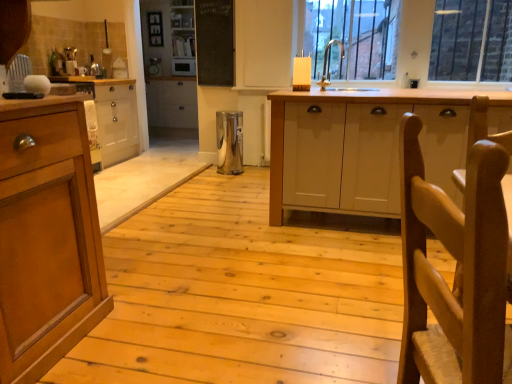
Question: In terms of height, does black chalkboard at upper center look taller or shorter compared to silver metallic sink at upper center?

Choices:
 (A) short
 (B) tall

Answer: (B)

Question: In terms of width, does black chalkboard at upper center look wider or thinner when compared to silver metallic sink at upper center?

Choices:
 (A) wide
 (B) thin

Answer: (B)

Question: Based on their relative distances, which object is nearer to the satin silver microwave at center, which appears as the second appliance when ordered from the bottom?

Choices:
 (A) silver metallic sink at upper center
 (B) wooden woven chair at right
 (C) white glossy cabinet at upper center
 (D) white matte cabinet at center, which is the 1th cabinetry from right to left
 (E) metallic trash can at center, marked as the first appliance in a front-to-back arrangement

Answer: (C)

Question: Which object is positioned farthest from the white matte cabinet at center, the first cabinetry from the front?

Choices:
 (A) satin silver microwave at center, placed as the 1th appliance when sorted from back to front
 (B) wooden cabinet at left, which is the first cabinetry in back-to-front order
 (C) white glossy cabinet at upper center
 (D) metallic trash can at center, the 1th appliance viewed from the right
 (E) wooden woven chair at right

Answer: (A)